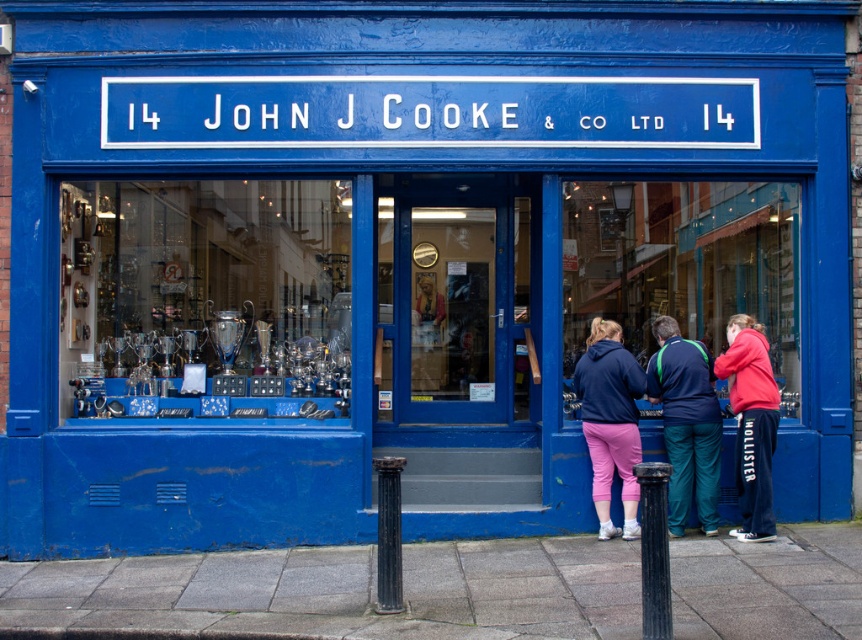
Question: Does matte blue hoodie at center have a larger size compared to pink fleece at lower right?

Choices:
 (A) yes
 (B) no

Answer: (B)

Question: Where is green fabric jacket at center located in relation to pink fleece at lower right in the image?

Choices:
 (A) below
 (B) above

Answer: (A)

Question: Among these points, which one is nearest to the camera?

Choices:
 (A) pos(665,474)
 (B) pos(753,500)
 (C) pos(663,234)

Answer: (A)

Question: Among these points, which one is farthest from the camera?

Choices:
 (A) (651, 262)
 (B) (684, 497)
 (C) (664, 595)
 (D) (742, 486)

Answer: (A)

Question: Which object is farther from the camera taking this photo?

Choices:
 (A) matte blue trophy case at center
 (B) green fabric jacket at center
 (C) black metal pole at center
 (D) black textured pole at lower center

Answer: (A)

Question: Does matte blue trophy case at center come in front of black textured pole at lower center?

Choices:
 (A) yes
 (B) no

Answer: (B)